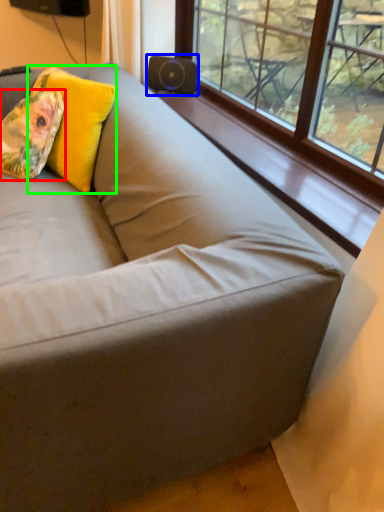
Question: Based on their relative distances, which object is nearer to throw pillow (highlighted by a red box)? Choose from speaker (highlighted by a blue box) and throw pillow (highlighted by a green box).

Choices:
 (A) speaker
 (B) throw pillow

Answer: (B)